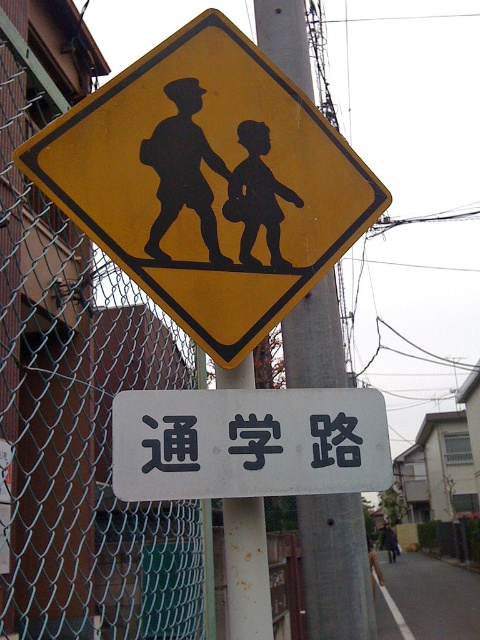
Can you confirm if yellow matte pedestrian crossing sign at upper center is shorter than metallic wire at upper center?

Yes, yellow matte pedestrian crossing sign at upper center is shorter than metallic wire at upper center.

Does point (345, 196) lie in front of point (472, 216)?

That is True.

You are a GUI agent. You are given a task and a screenshot of the screen. Output one action in this format:
    pyautogui.click(x=<x>, y=<y>)
    Task: Click on the yellow matte pedestrian crossing sign at upper center
    The height and width of the screenshot is (640, 480).
    Given the screenshot: What is the action you would take?
    pyautogui.click(x=208, y=182)

Can you confirm if green chain-link fence at left is positioned below black silhouette at upper center?

Yes.

Image resolution: width=480 pixels, height=640 pixels. What do you see at coordinates (74, 390) in the screenshot?
I see `green chain-link fence at left` at bounding box center [74, 390].

Is point (131, 532) positioned in front of point (204, 198)?

No, it is behind (204, 198).

This screenshot has width=480, height=640. I want to click on green chain-link fence at left, so click(x=74, y=390).

Who is positioned more to the right, green chain-link fence at left or metallic gray pole at center?

From the viewer's perspective, metallic gray pole at center appears more on the right side.

Which of these two, green chain-link fence at left or metallic gray pole at center, stands shorter?

metallic gray pole at center is shorter.

The width and height of the screenshot is (480, 640). In order to click on green chain-link fence at left in this screenshot , I will do `click(74, 390)`.